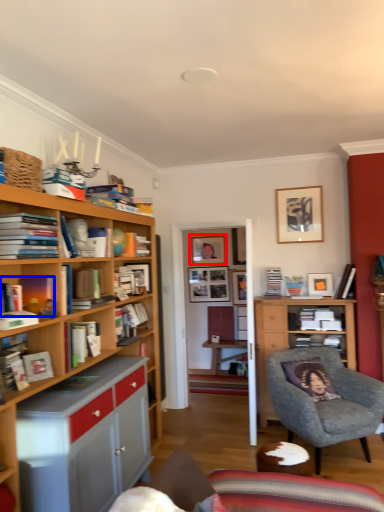
Question: Which object appears closest to the camera in this image, picture frame (highlighted by a red box) or book (highlighted by a blue box)?

Choices:
 (A) picture frame
 (B) book

Answer: (B)